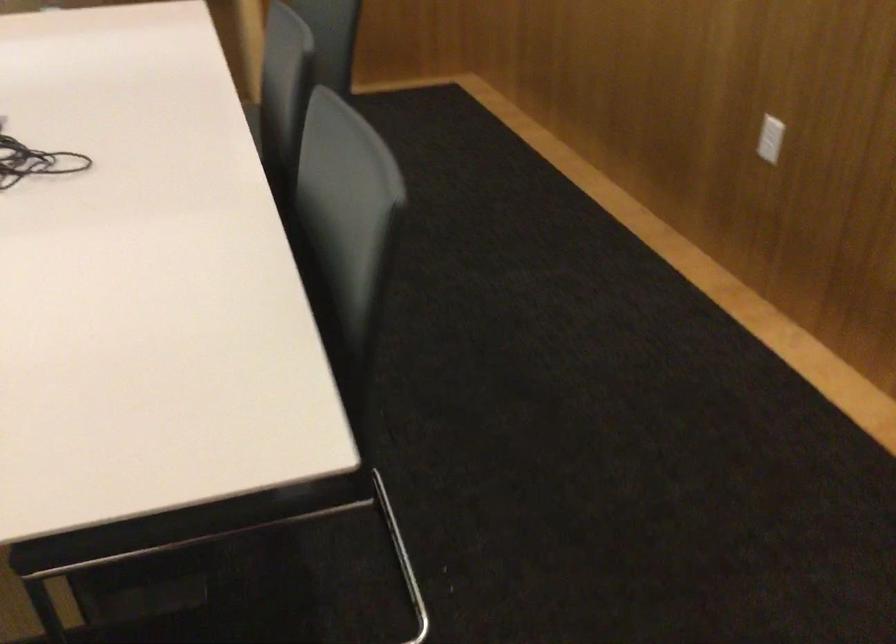
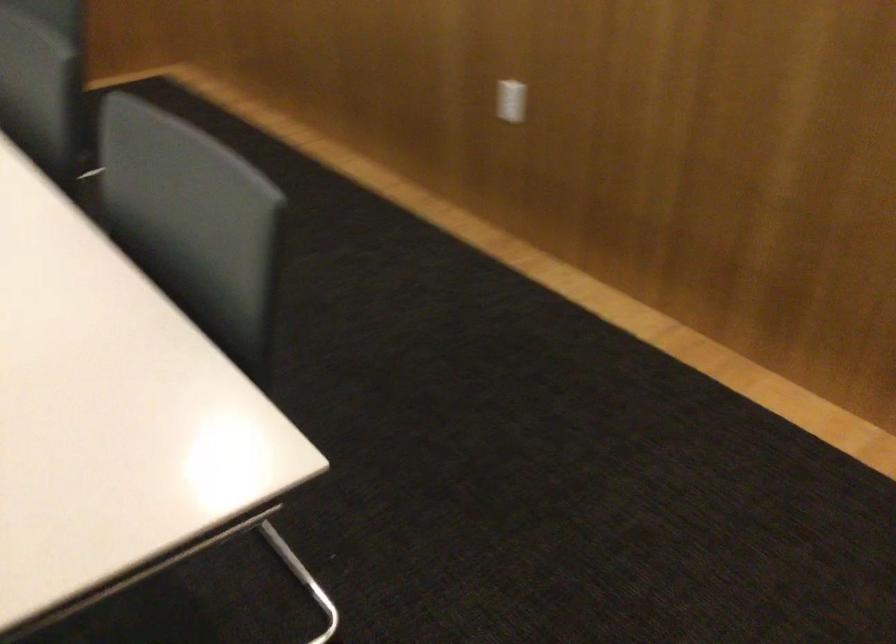
Question: The camera is either moving clockwise (left) or counter-clockwise (right) around the object. The first image is from the beginning of the video and the second image is from the end. Is the camera moving left or right when shooting the video?

Choices:
 (A) Left
 (B) Right

Answer: (A)